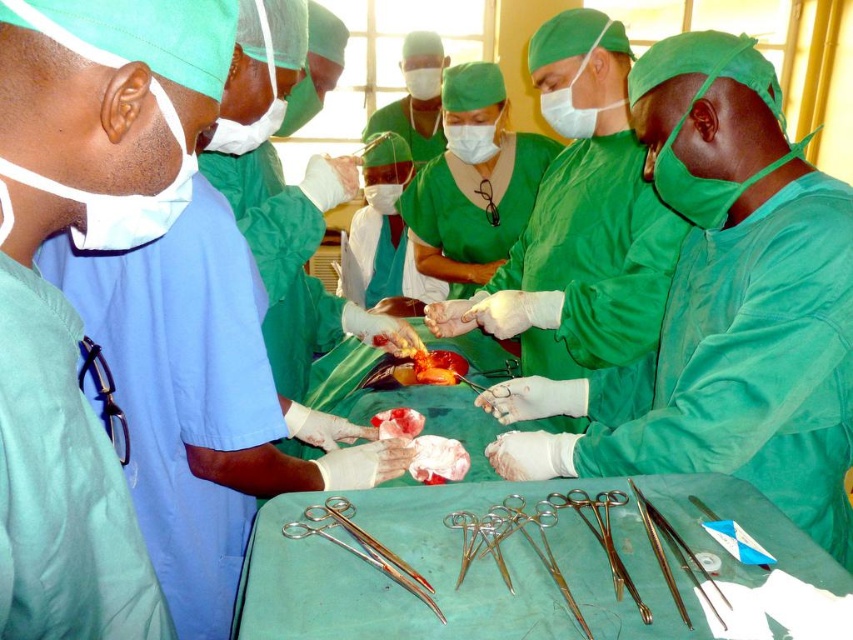
Question: Which object is closer to the camera taking this photo?

Choices:
 (A) surgical scissors at lower center
 (B) satin silver forceps at lower right
 (C) green matte surgical gown at center

Answer: (B)

Question: Can you confirm if green matte surgical gown at center is positioned to the right of surgical scissors at lower center?

Choices:
 (A) no
 (B) yes

Answer: (B)

Question: Which of the following is the closest to the observer?

Choices:
 (A) (315, 516)
 (B) (753, 426)
 (C) (679, 598)

Answer: (C)

Question: Is green matte surgical gown at center smaller than surgical scissors at lower center?

Choices:
 (A) no
 (B) yes

Answer: (A)

Question: In this image, where is surgical scissors at lower center located relative to satin silver forceps at lower right?

Choices:
 (A) above
 (B) below

Answer: (B)

Question: Which point is farther to the camera?

Choices:
 (A) satin silver forceps at lower right
 (B) green matte surgical gown at center

Answer: (B)